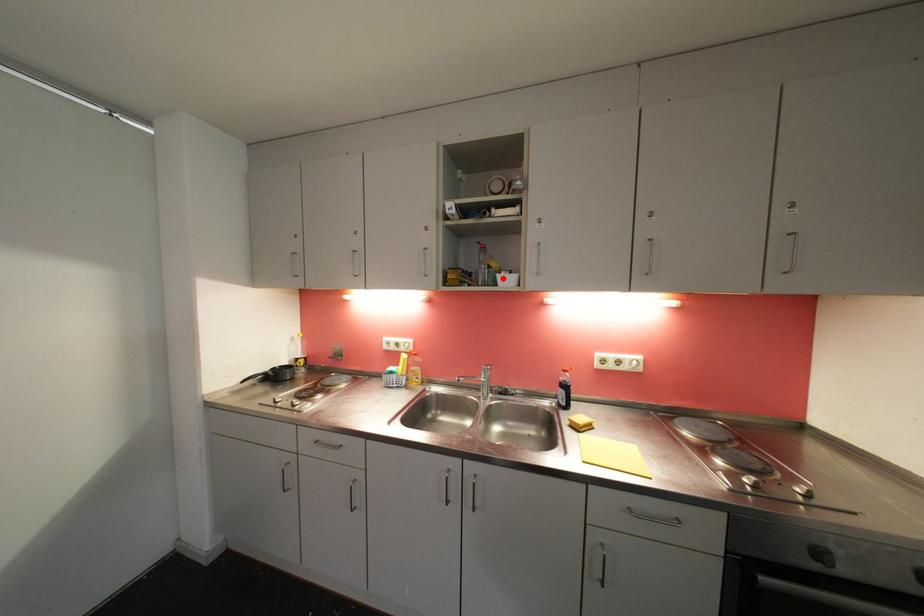
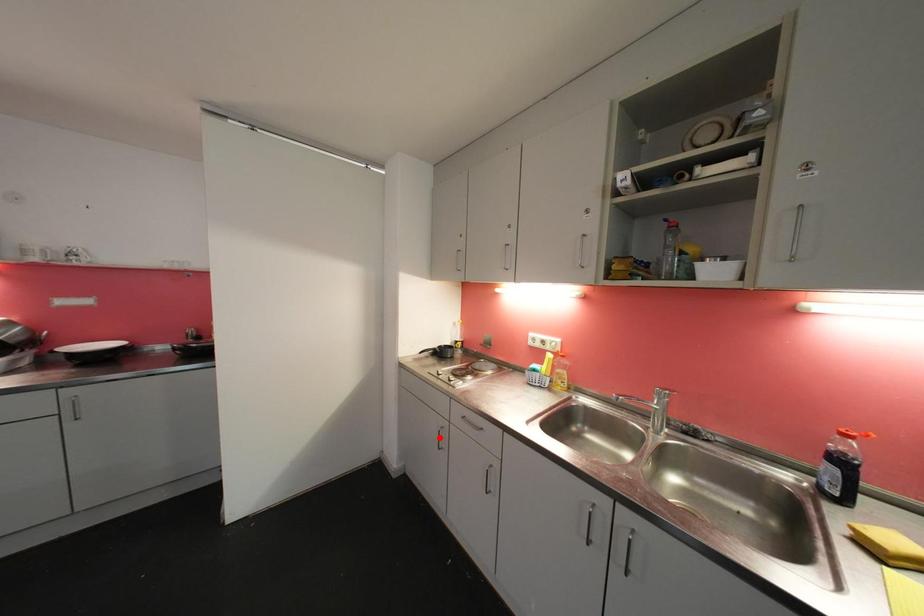
I am providing you with two images of the same scene from different viewpoints. A red point is marked on the first image and another point is marked on the second image. Are the points marked in image1 and image2 representing the same 3D position?

No